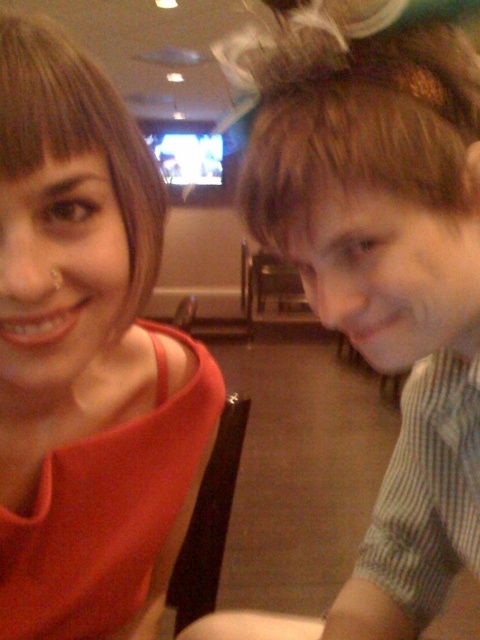
Question: Which point appears closest to the camera in this image?

Choices:
 (A) (469, 186)
 (B) (55, 305)

Answer: (B)

Question: Is striped cotton shirt at right bigger than matte red dress at upper left?

Choices:
 (A) no
 (B) yes

Answer: (B)

Question: Is striped cotton shirt at right bigger than matte red dress at upper left?

Choices:
 (A) yes
 (B) no

Answer: (A)

Question: Can you confirm if striped cotton shirt at right is positioned to the right of matte red dress at upper left?

Choices:
 (A) yes
 (B) no

Answer: (A)

Question: Which point is closer to the camera?

Choices:
 (A) matte red dress at upper left
 (B) striped cotton shirt at right

Answer: (A)